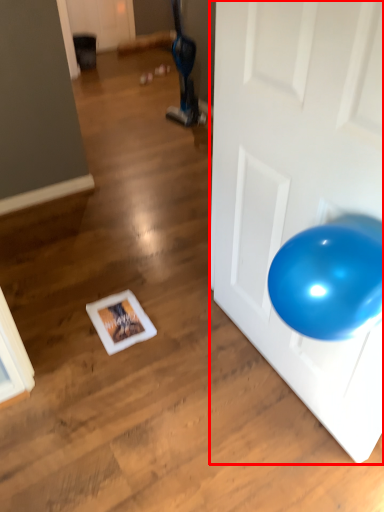
Question: Observing the image, what is the correct spatial positioning of door (annotated by the red box) in reference to bean bag chair?

Choices:
 (A) left
 (B) right

Answer: (B)